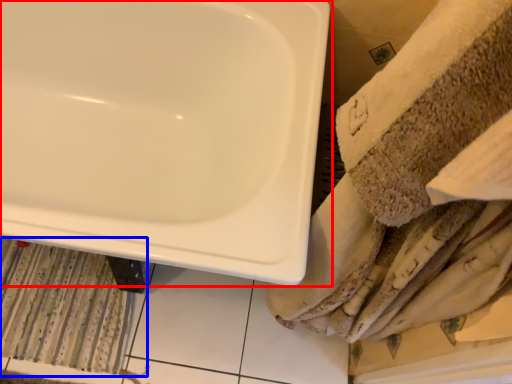
Question: Which point is closer to the camera, sink (highlighted by a red box) or bath mat (highlighted by a blue box)?

Choices:
 (A) sink
 (B) bath mat

Answer: (A)